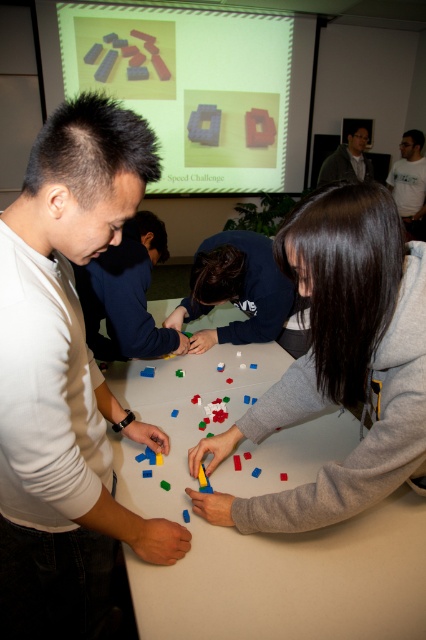
Question: Is the position of blue fabric shirt at center less distant than that of matte gray shirt at upper right?

Choices:
 (A) yes
 (B) no

Answer: (A)

Question: Which point is closer to the camera?

Choices:
 (A) (244, 301)
 (B) (416, 276)
 (C) (221, 545)

Answer: (B)

Question: Which point is farther to the camera?

Choices:
 (A) (31, 150)
 (B) (129, 273)
 (C) (313, 499)

Answer: (B)

Question: Which point is farther to the camera?

Choices:
 (A) matte gray shirt at upper right
 (B) white matte table at center
 (C) blue fabric shirt at center
 (D) matte white shirt at center

Answer: (A)

Question: Is matte white shirt at center in front of matte gray shirt at upper right?

Choices:
 (A) no
 (B) yes

Answer: (B)

Question: Is matte white shirt at left below matte white shirt at center?

Choices:
 (A) yes
 (B) no

Answer: (A)